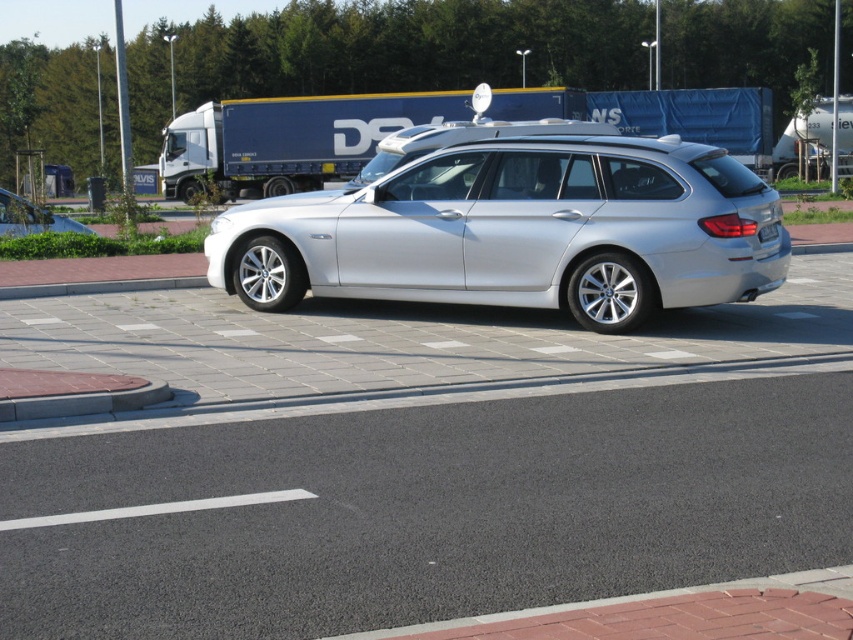
Question: Is sleek silver wagon at center to the right of black plastic license plate at rear from the viewer's perspective?

Choices:
 (A) yes
 (B) no

Answer: (B)

Question: Observing the image, what is the correct spatial positioning of sleek silver wagon at center in reference to blue tarpaulin trailer truck at center?

Choices:
 (A) left
 (B) right

Answer: (B)

Question: Which of the following is the farthest from the observer?

Choices:
 (A) black plastic license plate at rear
 (B) matte silver car at left

Answer: (B)

Question: Is the position of blue tarpaulin trailer truck at center less distant than that of black plastic license plate at rear?

Choices:
 (A) no
 (B) yes

Answer: (A)

Question: Based on their relative distances, which object is farther from the black plastic license plate at rear?

Choices:
 (A) sleek silver wagon at center
 (B) matte silver car at left

Answer: (B)

Question: Which point is farther from the camera taking this photo?

Choices:
 (A) (519, 220)
 (B) (758, 125)
 (C) (16, 200)

Answer: (B)